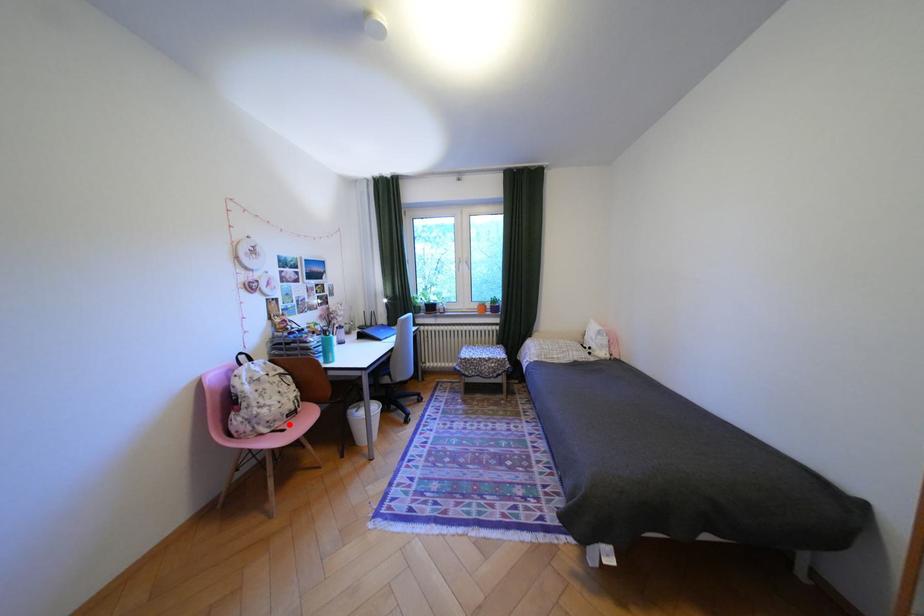
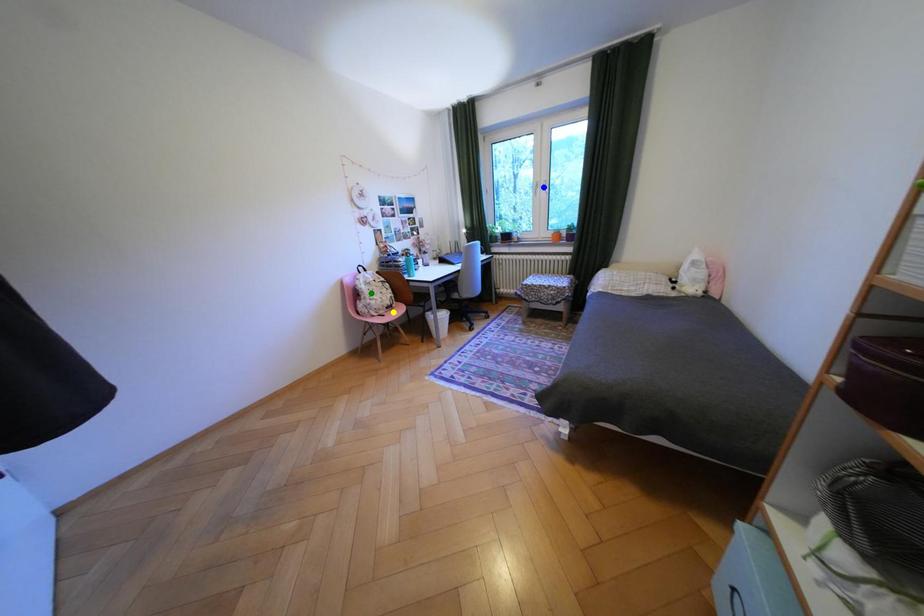
Question: I am providing you with two images of the same scene from different viewpoints. A red point is marked on the first image. You are given multiple points on the second image. Which point in image 2 is actually the same real-world point as the red point in image 1?

Choices:
 (A) blue point
 (B) green point
 (C) yellow point

Answer: (C)